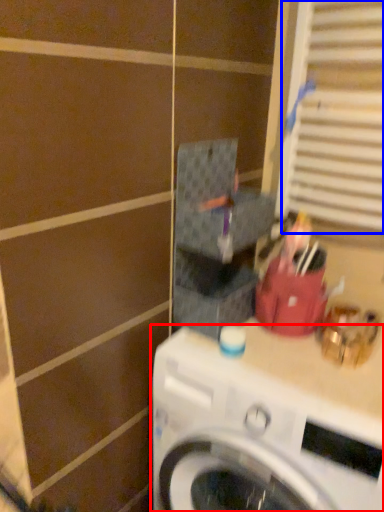
Question: Which object appears farthest to the camera in this image, washing machine (highlighted by a red box) or window (highlighted by a blue box)?

Choices:
 (A) washing machine
 (B) window

Answer: (B)